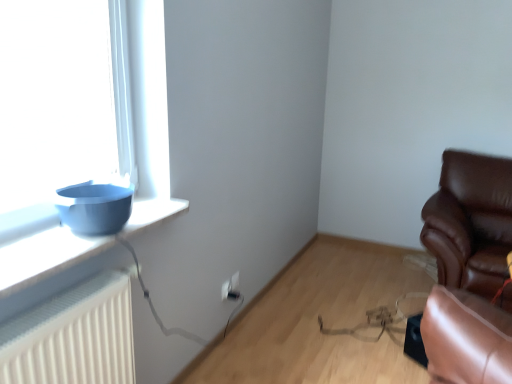
Question: Should I look upward or downward to see brown leather chair at right?

Choices:
 (A) down
 (B) up

Answer: (A)

Question: Is white plastic electric outlet at lower center turned away from brown leather chair at right?

Choices:
 (A) yes
 (B) no

Answer: (B)

Question: Are white plastic electric outlet at lower center and brown leather chair at right making contact?

Choices:
 (A) yes
 (B) no

Answer: (B)

Question: Is white plastic electric outlet at lower center not near brown leather chair at right?

Choices:
 (A) no
 (B) yes

Answer: (B)

Question: Is white plastic electric outlet at lower center in front of brown leather chair at right?

Choices:
 (A) yes
 (B) no

Answer: (B)

Question: Considering the relative positions of white plastic electric outlet at lower center and brown leather chair at right in the image provided, is white plastic electric outlet at lower center behind brown leather chair at right?

Choices:
 (A) yes
 (B) no

Answer: (A)

Question: Is white plastic electric outlet at lower center thinner than brown leather chair at right?

Choices:
 (A) no
 (B) yes

Answer: (B)

Question: Considering the relative sizes of matte blue bowl at left and white plastic electric outlet at lower center in the image provided, is matte blue bowl at left wider than white plastic electric outlet at lower center?

Choices:
 (A) no
 (B) yes

Answer: (B)

Question: Can you confirm if matte blue bowl at left is positioned to the left of white plastic electric outlet at lower center?

Choices:
 (A) yes
 (B) no

Answer: (A)

Question: Is matte blue bowl at left not close to white plastic electric outlet at lower center?

Choices:
 (A) no
 (B) yes

Answer: (B)

Question: From the image's perspective, does matte blue bowl at left appear lower than white plastic electric outlet at lower center?

Choices:
 (A) yes
 (B) no

Answer: (B)

Question: Is matte blue bowl at left facing away from white plastic electric outlet at lower center?

Choices:
 (A) no
 (B) yes

Answer: (A)

Question: Can you confirm if matte blue bowl at left is smaller than white plastic electric outlet at lower center?

Choices:
 (A) yes
 (B) no

Answer: (B)

Question: From the image's perspective, is brown leather chair at right on top of white plastic electric outlet at lower center?

Choices:
 (A) yes
 (B) no

Answer: (A)